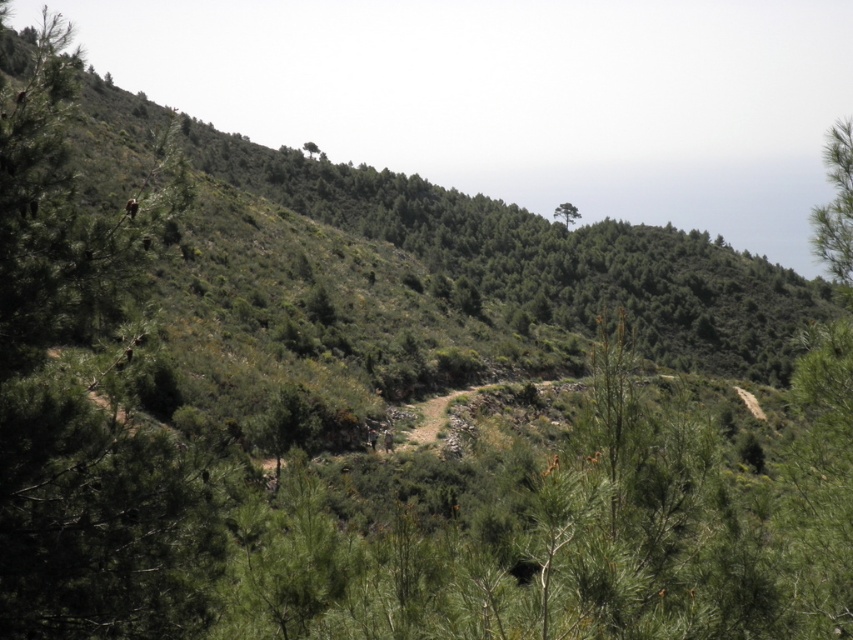
You are standing at the point with coordinates point (822, 237) and want to walk to point (579, 216). Given the winding dirt path in the scene, will you be moving uphill or downhill?

Since point (822, 237) is closer to the camera than point (579, 216), you will be moving uphill towards the latter point as it is further away from the camera, implying a higher elevation.

You are standing at the bottom of the hillside and want to reach the green leafy tree at upper right. Which direction should you walk to get there?

You should walk upwards and towards the right to reach the green leafy tree at upper right as it is located at point (836,208).